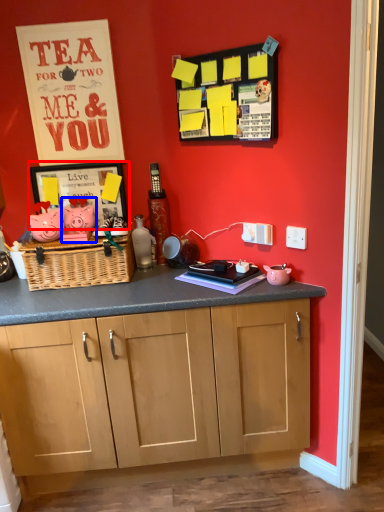
Question: Among these objects, which one is nearest to the camera, picture frame (highlighted by a red box) or toy (highlighted by a blue box)?

Choices:
 (A) picture frame
 (B) toy

Answer: (B)